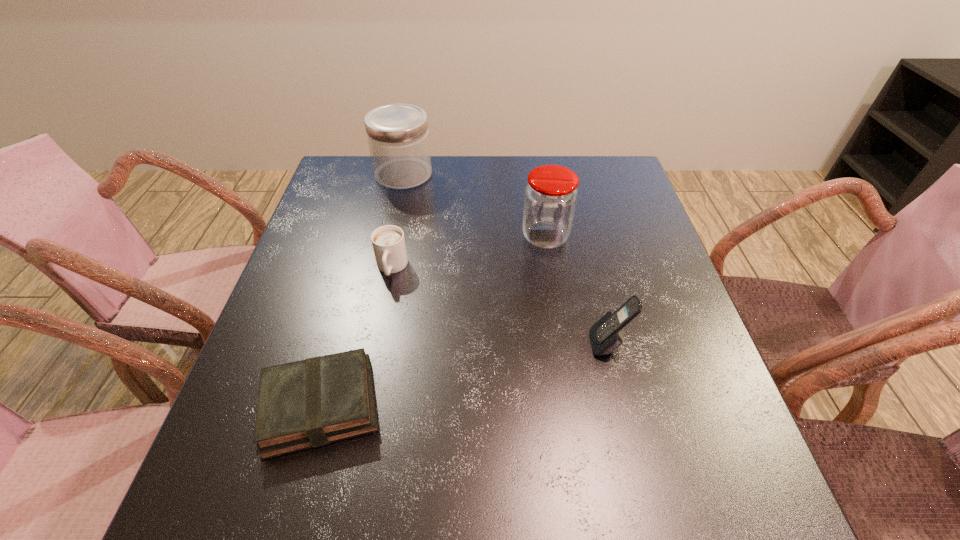
At what (x,y) coordinates should I click in order to perform the action: click on the farthest object. Please return your answer as a coordinate pair (x, y). Looking at the image, I should click on (398, 137).

The height and width of the screenshot is (540, 960). I want to click on the farther jar, so click(x=398, y=137).

Image resolution: width=960 pixels, height=540 pixels. What are the coordinates of `the nearer jar` in the screenshot? It's located at (550, 200).

Find the location of a particular element. cellular telephone is located at coordinates (606, 336).

Where is `the second nearest object`? The height and width of the screenshot is (540, 960). the second nearest object is located at coordinates (606, 336).

Find the location of a particular element. This screenshot has width=960, height=540. the second shortest object is located at coordinates (388, 241).

Locate an element on the screen. the shortest object is located at coordinates (314, 402).

Find the location of a particular element. This screenshot has height=540, width=960. the nearest object is located at coordinates (314, 402).

Image resolution: width=960 pixels, height=540 pixels. What are the coordinates of `free space located on the right of the left jar` in the screenshot? It's located at (506, 174).

Identify the location of vacant space located 0.200m on the right of the right jar. The height and width of the screenshot is (540, 960). (649, 237).